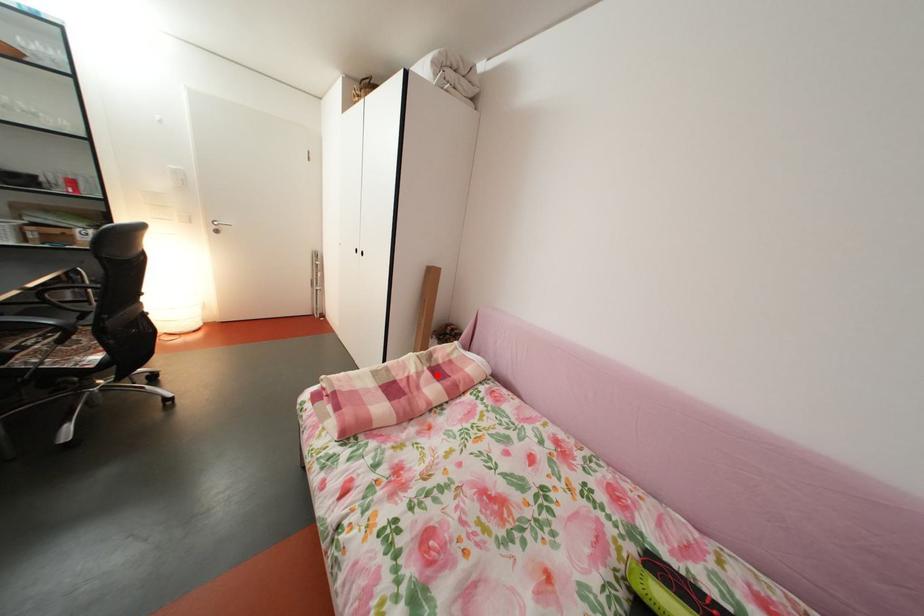
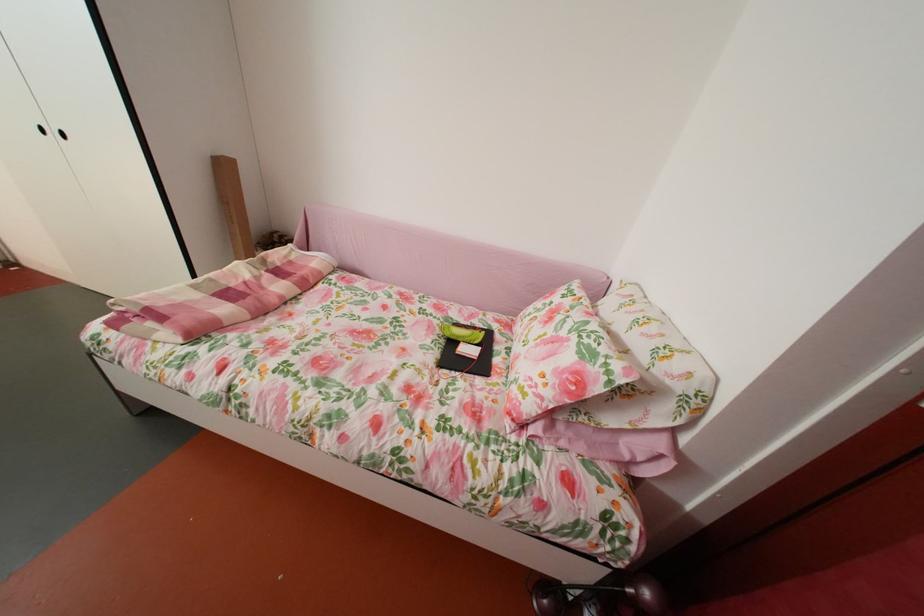
Find the pixel in the second image that matches the highlighted location in the first image.

(274, 278)